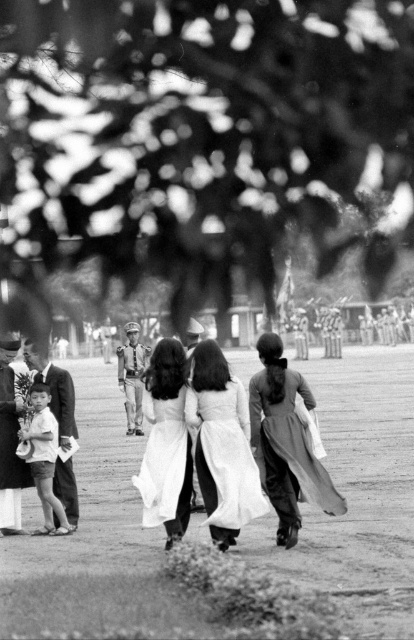
Question: Estimate the real-world distances between objects in this image. Which object is farther from the white satin dress at center?

Choices:
 (A) dark green leafy tree at upper center
 (B) white silk ao dai at center
 (C) silky white dress at center

Answer: (A)

Question: Which point is closer to the camera?

Choices:
 (A) pos(233,433)
 (B) pos(166,492)

Answer: (B)

Question: Does white satin dress at center have a smaller size compared to white silk ao dai at center?

Choices:
 (A) yes
 (B) no

Answer: (B)

Question: Which point appears closest to the camera in this image?

Choices:
 (A) (382, 48)
 (B) (277, 429)
 (C) (149, 410)
 (D) (190, 388)

Answer: (D)

Question: Is dark green leafy tree at upper center smaller than white silk ao dai at center?

Choices:
 (A) no
 (B) yes

Answer: (A)

Question: Is silky white dress at center wider than white satin dress at center?

Choices:
 (A) no
 (B) yes

Answer: (B)